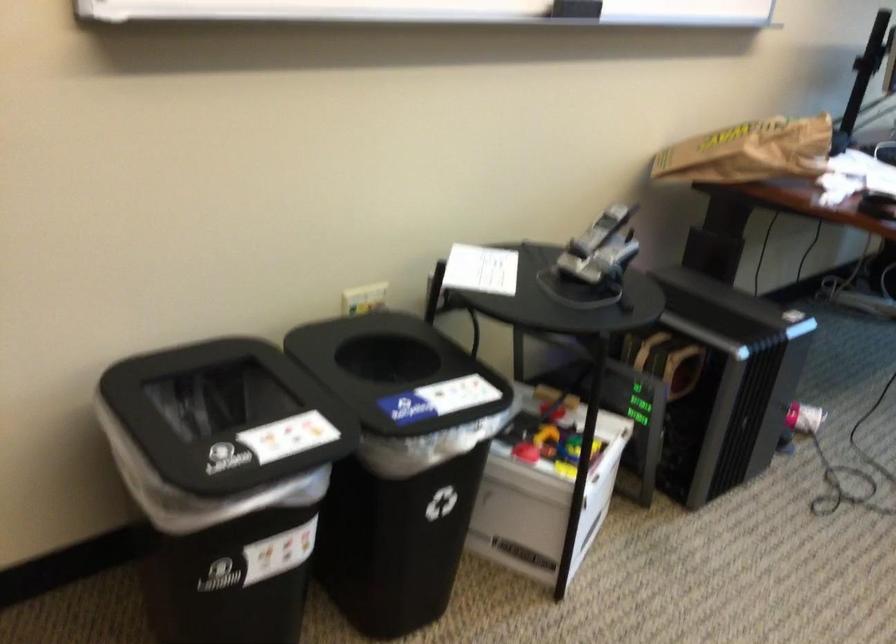
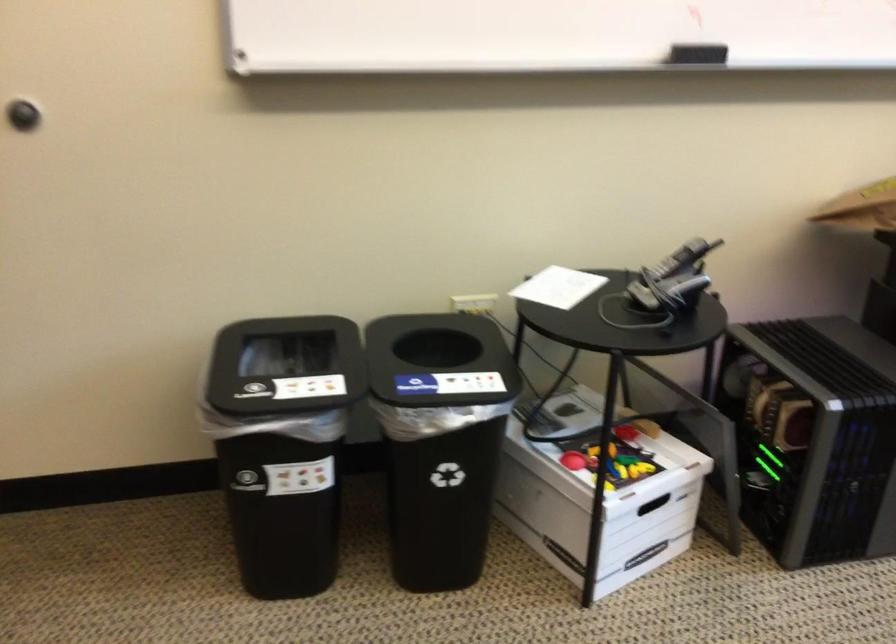
Find the pixel in the second image that matches point 351,371 in the first image.

(438, 361)